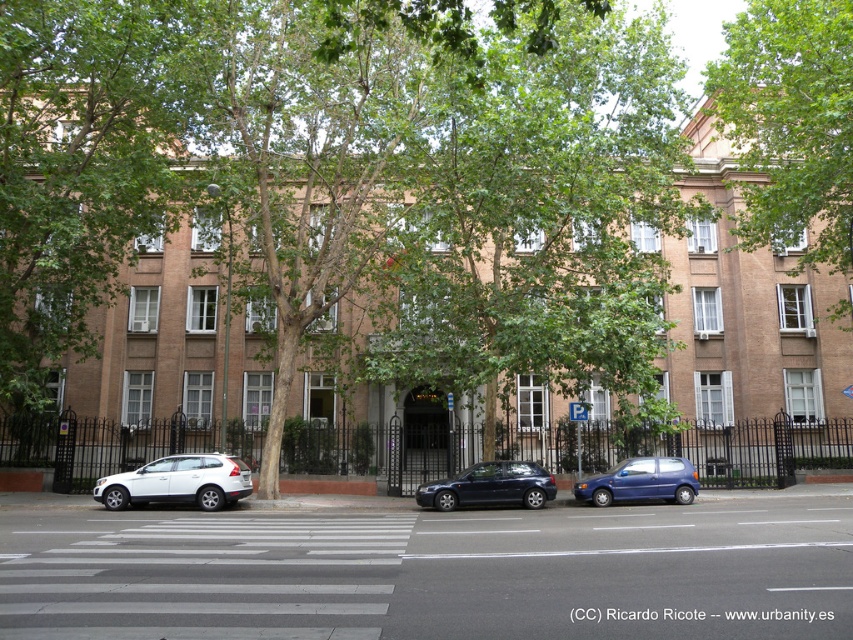
Question: Which object is farther from the camera taking this photo?

Choices:
 (A) green leafy tree at upper center
 (B) shiny dark blue sedan at center

Answer: (B)

Question: Among these objects, which one is farthest from the camera?

Choices:
 (A) white matte suv at lower left
 (B) green leafy tree at upper center
 (C) shiny dark blue sedan at center

Answer: (C)

Question: Can you confirm if white matte suv at lower left is thinner than shiny dark blue sedan at center?

Choices:
 (A) no
 (B) yes

Answer: (A)

Question: Is green leafy tree at center to the left of white matte suv at lower left from the viewer's perspective?

Choices:
 (A) yes
 (B) no

Answer: (A)

Question: Can you confirm if green leafy tree at upper center is smaller than metallic blue hatchback at center?

Choices:
 (A) no
 (B) yes

Answer: (A)

Question: Based on their relative distances, which object is farther from the green leafy tree at center?

Choices:
 (A) shiny dark blue sedan at center
 (B) metallic blue hatchback at center
 (C) white matte suv at lower left

Answer: (B)